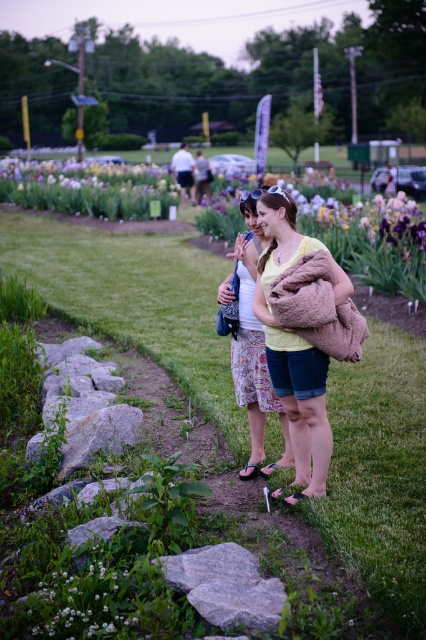
You are a landscape architect designing a new garden path. You want to place two benches so that they are exactly 12 meters apart. The purple matte flowers at upper center are a reference point. Where should you place the benches relative to the flowers?

Place one bench at the location of the purple matte flowers at upper center and the other bench 12 meters away from them to meet the 12 meters apart requirement.

You are a photographer trying to capture both the purple matte flowers at upper center and the light brown fuzzy coat at center in a single shot. Which object should you focus on first to ensure both are in focus?

You should focus on the purple matte flowers at upper center first because it is closer to the viewer than the light brown fuzzy coat at center, so adjusting focus from near to far will help both be in focus.

You are a photographer trying to capture a photo of the purple matte flowers at upper center and the light brown fuzzy coat at center. Based on their positions, which object should you focus on first to ensure both are in the frame?

The light brown fuzzy coat at center should be focused on first since the purple matte flowers at upper center is above it, ensuring both will be in the frame when starting from the lower object.